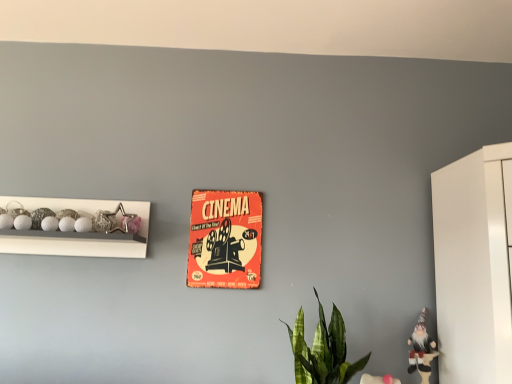
Question: Visually, is white glossy beads at left positioned to the left or to the right of white fabric gnome at lower right, which appears as the first toy when viewed from the right?

Choices:
 (A) left
 (B) right

Answer: (A)

Question: Is white glossy beads at left taller or shorter than white fabric gnome at lower right, the second toy from the left?

Choices:
 (A) short
 (B) tall

Answer: (A)

Question: Which object is positioned closest to the white fabric gnome at lower right, which appears as the 1th toy when ordered from the bottom?

Choices:
 (A) orange paper poster at center
 (B) green leafy plant at lower center
 (C) metallic star at left, the 2th toy when ordered from right to left
 (D) white glossy beads at left

Answer: (B)

Question: Which of these objects is positioned closest to the orange paper poster at center?

Choices:
 (A) white fabric gnome at lower right, arranged as the 2th toy when viewed from the top
 (B) green leafy plant at lower center
 (C) white glossy beads at left
 (D) metallic star at left, which is the second toy in bottom-to-top order

Answer: (D)